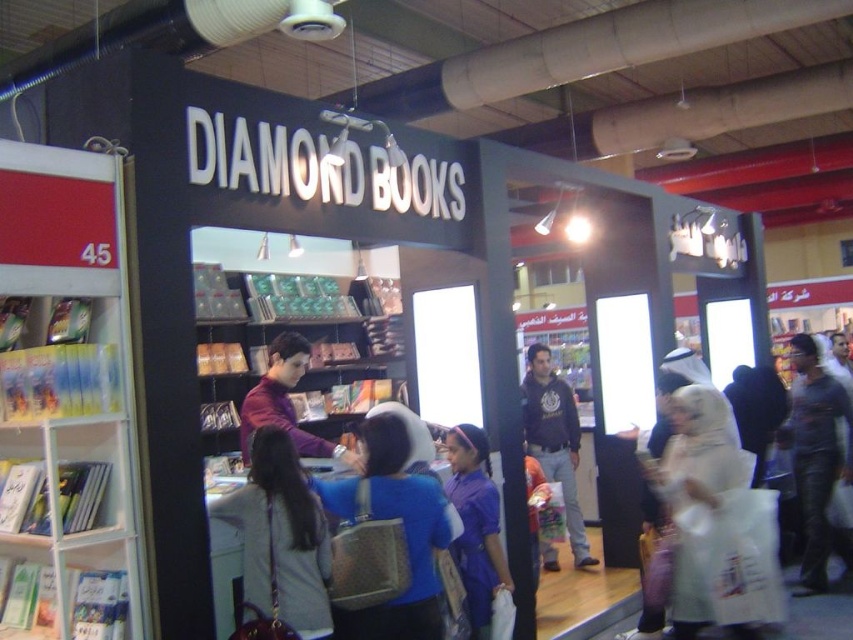
Question: Which point is farther from the camera taking this photo?

Choices:
 (A) (471, 579)
 (B) (109, 346)
 (C) (271, 460)

Answer: (A)

Question: Which object appears farthest from the camera in this image?

Choices:
 (A) dark blue hoodie at center
 (B) matte wooden bookshelf at center
 (C) purple fabric dress at center

Answer: (B)

Question: Which object is the closest to the matte gray backpack at center?

Choices:
 (A) dark blue hoodie at center
 (B) white plastic bookshelf at left
 (C) purple fabric dress at center
 (D) blue fabric backpack at center

Answer: (D)

Question: Can you confirm if matte wooden bookshelf at center is thinner than matte gray backpack at center?

Choices:
 (A) no
 (B) yes

Answer: (A)

Question: Is matte gray backpack at center thinner than leather jacket at center?

Choices:
 (A) yes
 (B) no

Answer: (A)

Question: Is leather jacket at center further to the viewer compared to dark blue hoodie at center?

Choices:
 (A) no
 (B) yes

Answer: (A)